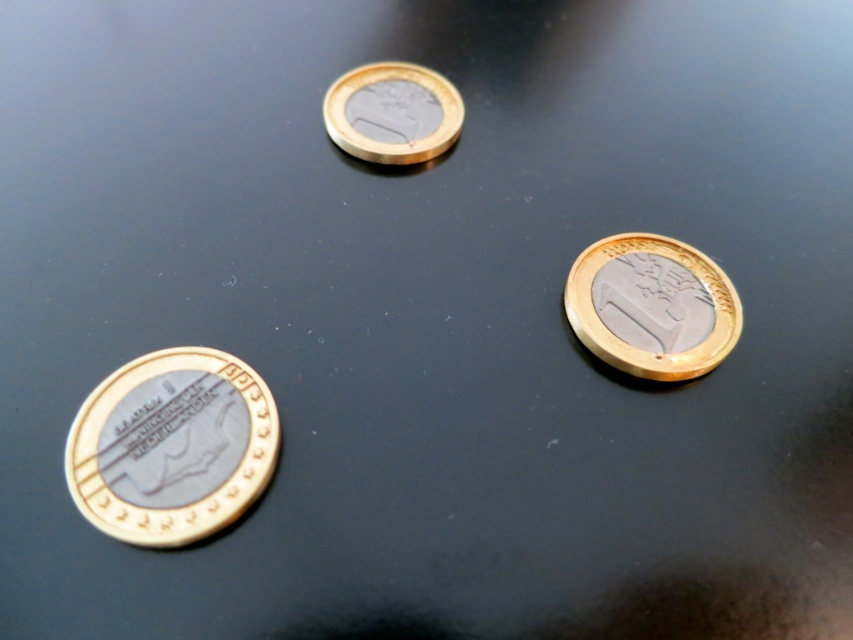
Question: Which of the following is the closest to the observer?

Choices:
 (A) gold-plated coin at bottom left
 (B) gold-plated coin at center

Answer: (A)

Question: In this image, where is gold-plated euro coin at center-right located relative to gold-plated coin at center?

Choices:
 (A) below
 (B) above

Answer: (A)

Question: Which point is farther to the camera?

Choices:
 (A) (413, 81)
 (B) (183, 467)
 (C) (682, 253)

Answer: (A)

Question: From the image, what is the correct spatial relationship of gold-plated coin at bottom left in relation to gold-plated coin at center?

Choices:
 (A) left
 (B) right

Answer: (A)

Question: Based on their relative distances, which object is farther from the gold-plated coin at bottom left?

Choices:
 (A) gold-plated euro coin at center-right
 (B) gold-plated coin at center

Answer: (A)

Question: Is gold-plated coin at bottom left below gold-plated coin at center?

Choices:
 (A) no
 (B) yes

Answer: (B)